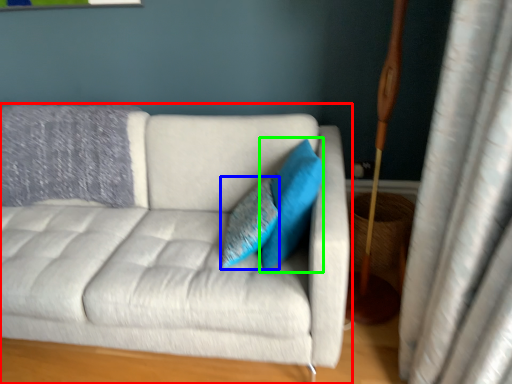
Question: Which object is positioned closest to studio couch (highlighted by a red box)? Select from pillow (highlighted by a blue box) and pillow (highlighted by a green box).

Choices:
 (A) pillow
 (B) pillow

Answer: (A)